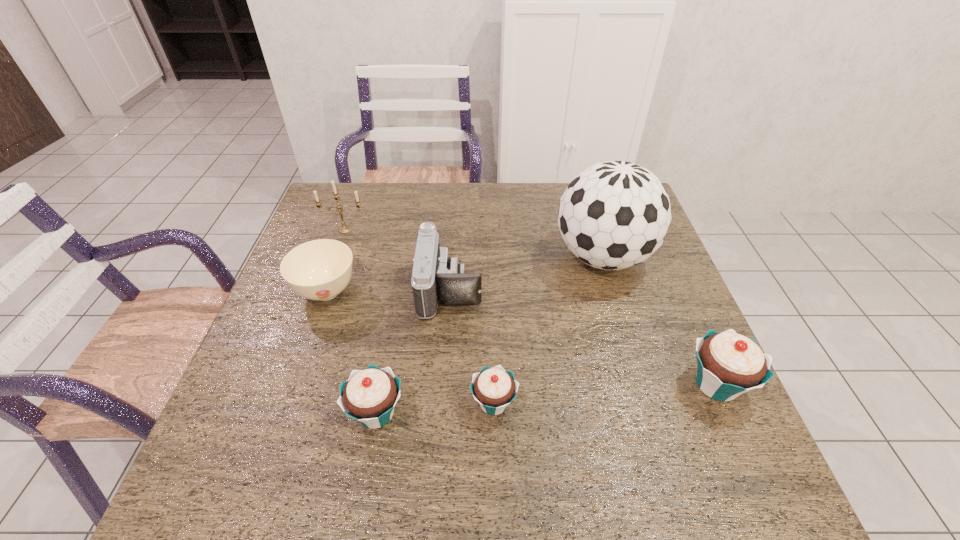
Please point a location where one more cupcake can be added evenly. Please provide its 2D coordinates. Your answer should be formatted as a tuple, i.e. [(x, y)], where the tuple contains the x and y coordinates of a point satisfying the conditions above.

[(607, 394)]